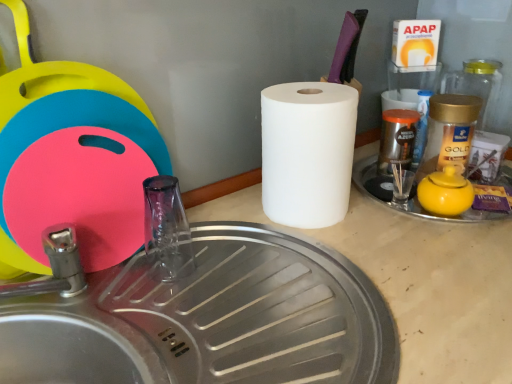
Where is `free space in front of transparent glass faucet at center`? The width and height of the screenshot is (512, 384). free space in front of transparent glass faucet at center is located at coordinates (183, 319).